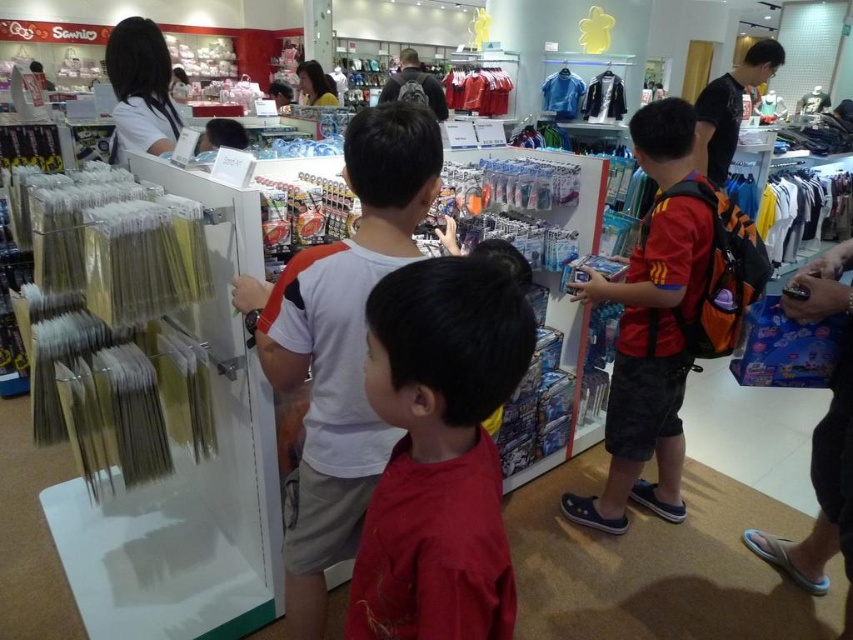
Can you confirm if red polyester shirt at center is positioned to the right of matte white shirt at upper center?

Correct, you'll find red polyester shirt at center to the right of matte white shirt at upper center.

Is point (608, 490) positioned before point (303, 74)?

That is True.

Is point (628, 474) in front of point (323, 99)?

That is True.

At what (x,y) coordinates should I click in order to perform the action: click on red polyester shirt at center. Please return your answer as a coordinate pair (x, y). The width and height of the screenshot is (853, 640). Looking at the image, I should click on (648, 364).

Who is more forward, [677,170] or [718,177]?

Positioned in front is point [677,170].

Who is taller, red polyester shirt at center or black matte backpack at upper right?

red polyester shirt at center is taller.

Does point (598, 499) come behind point (769, 58)?

No, it is not.

The image size is (853, 640). In order to click on red polyester shirt at center in this screenshot , I will do `click(648, 364)`.

Is the position of white matte shirt at center more distant than that of matte white shirt at upper left?

That is False.

The height and width of the screenshot is (640, 853). What are the coordinates of `white matte shirt at center` in the screenshot? It's located at (341, 342).

Locate an element on the screen. white matte shirt at center is located at coordinates (341, 342).